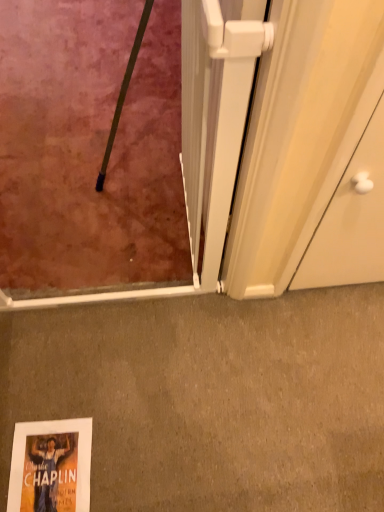
In order to click on white plastic screen door at center in this screenshot , I will do `click(215, 115)`.

What do you see at coordinates (215, 115) in the screenshot?
I see `white plastic screen door at center` at bounding box center [215, 115].

Find the location of `matte gray carpet at lower center`. matte gray carpet at lower center is located at coordinates (210, 398).

Describe the element at coordinates (210, 398) in the screenshot. I see `matte gray carpet at lower center` at that location.

Where is `white plastic screen door at center`? white plastic screen door at center is located at coordinates (215, 115).

Considering the relative positions of matte gray carpet at lower center and white plastic screen door at center in the image provided, is matte gray carpet at lower center to the right of white plastic screen door at center from the viewer's perspective?

Yes.

In the image, is matte gray carpet at lower center positioned in front of or behind white plastic screen door at center?

In the image, matte gray carpet at lower center appears behind white plastic screen door at center.

Considering the positions of point (206, 463) and point (200, 125), is point (206, 463) closer or farther from the camera than point (200, 125)?

Point (206, 463) appears to be farther away from the viewer than point (200, 125).

From the image's perspective, is matte gray carpet at lower center above or below white plastic screen door at center?

matte gray carpet at lower center is below white plastic screen door at center.

From a real-world perspective, is matte gray carpet at lower center positioned under white plastic screen door at center based on gravity?

Yes, from a real-world perspective, matte gray carpet at lower center is beneath white plastic screen door at center.

Which object is wider, matte gray carpet at lower center or white plastic screen door at center?

matte gray carpet at lower center is wider.

Between matte gray carpet at lower center and white plastic screen door at center, which one has more height?

white plastic screen door at center is taller.

Is matte gray carpet at lower center smaller than white plastic screen door at center?

Indeed, matte gray carpet at lower center has a smaller size compared to white plastic screen door at center.

Is matte gray carpet at lower center completely or partially outside of white plastic screen door at center?

matte gray carpet at lower center is positioned outside white plastic screen door at center.

Is matte gray carpet at lower center far away from white plastic screen door at center?

matte gray carpet at lower center is actually quite close to white plastic screen door at center.

Is white plastic screen door at center at the back of matte gray carpet at lower center?

matte gray carpet at lower center does not have its back to white plastic screen door at center.

Image resolution: width=384 pixels, height=512 pixels. I want to click on screen door positioned vertically above the matte gray carpet at lower center (from a real-world perspective), so click(x=215, y=115).

Which object is positioned more to the right, white plastic screen door at center or matte gray carpet at lower center?

Positioned to the right is matte gray carpet at lower center.

Does white plastic screen door at center lie behind matte gray carpet at lower center?

No, the depth of white plastic screen door at center is less than that of matte gray carpet at lower center.

Which is closer to the camera, [198,111] or [258,312]?

The point [198,111] is more forward.

From the image's perspective, which is below, white plastic screen door at center or matte gray carpet at lower center?

matte gray carpet at lower center.

From a real-world perspective, does white plastic screen door at center sit lower than matte gray carpet at lower center?

No, from a real-world perspective, white plastic screen door at center is not under matte gray carpet at lower center.

Is white plastic screen door at center thinner than matte gray carpet at lower center?

Correct, the width of white plastic screen door at center is less than that of matte gray carpet at lower center.

Between white plastic screen door at center and matte gray carpet at lower center, which one has less height?

matte gray carpet at lower center is shorter.

Based on the photo, is white plastic screen door at center bigger than matte gray carpet at lower center?

Correct, white plastic screen door at center is larger in size than matte gray carpet at lower center.

Is matte gray carpet at lower center located within white plastic screen door at center?

No, matte gray carpet at lower center is located outside of white plastic screen door at center.

Is white plastic screen door at center beside matte gray carpet at lower center?

No, white plastic screen door at center is not with matte gray carpet at lower center.

Could you tell me if white plastic screen door at center is turned towards matte gray carpet at lower center?

No, white plastic screen door at center is not facing towards matte gray carpet at lower center.

Based on the photo, how many degrees apart are the facing directions of white plastic screen door at center and matte gray carpet at lower center?

The angle between the facing direction of white plastic screen door at center and the facing direction of matte gray carpet at lower center is 90 degrees.

Measure the distance from white plastic screen door at center to matte gray carpet at lower center.

19.26 inches.

Identify the location of concrete below the white plastic screen door at center (from the image's perspective). (210, 398).

You are a GUI agent. You are given a task and a screenshot of the screen. Output one action in this format:
    pyautogui.click(x=<x>, y=<y>)
    Task: Click on the screen door lying above the matte gray carpet at lower center (from the image's perspective)
    The image size is (384, 512).
    Given the screenshot: What is the action you would take?
    pyautogui.click(x=215, y=115)

Where is `screen door to the left of matte gray carpet at lower center`? The height and width of the screenshot is (512, 384). screen door to the left of matte gray carpet at lower center is located at coordinates (215, 115).